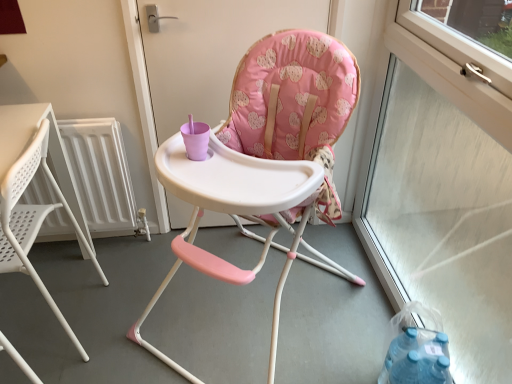
Where is `vacant area that lies between white plastic chair at left, the first chair viewed from the left, and white metallic radiator at left`? Image resolution: width=512 pixels, height=384 pixels. vacant area that lies between white plastic chair at left, the first chair viewed from the left, and white metallic radiator at left is located at coordinates (91, 274).